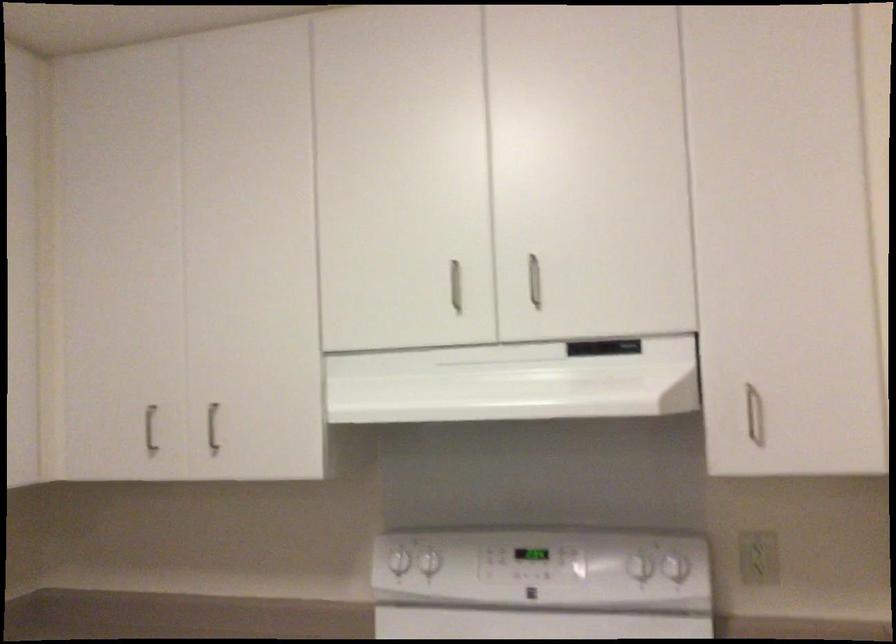
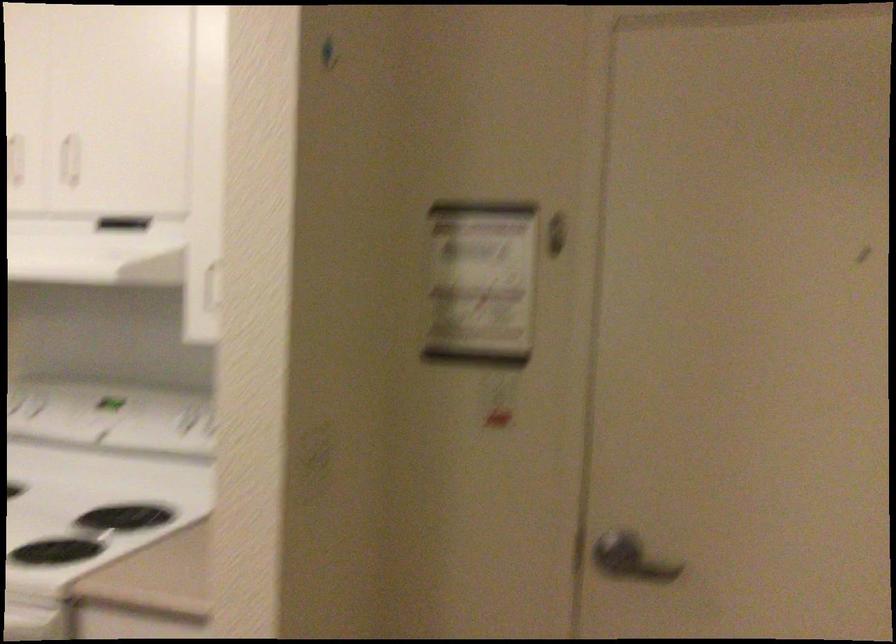
Question: What movement of the cameraman would produce the second image?

Choices:
 (A) Left
 (B) Right
 (C) Forward
 (D) Backward

Answer: (B)